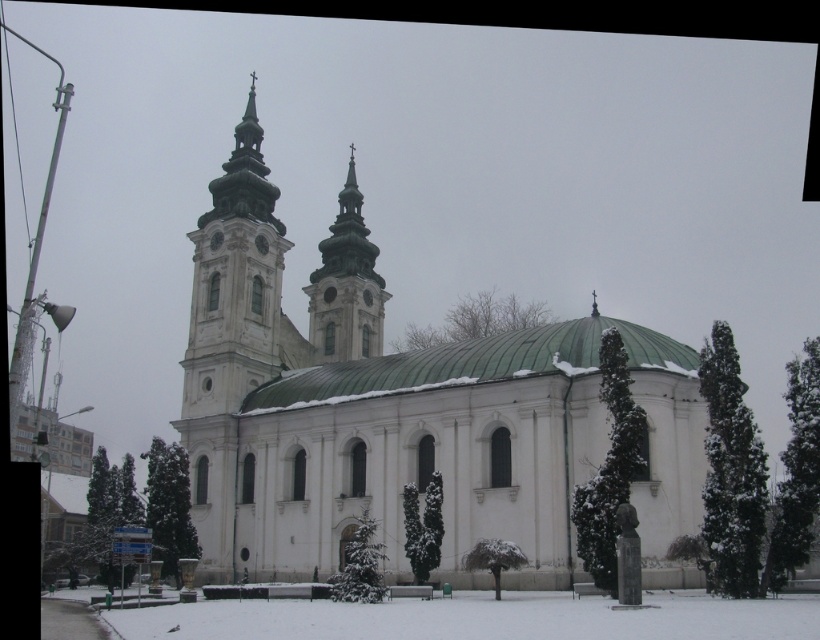
Between white stone tower at upper left and smooth white steeple at center, which one is positioned higher?

smooth white steeple at center

Where is `white stone tower at upper left`? Image resolution: width=820 pixels, height=640 pixels. white stone tower at upper left is located at coordinates (235, 282).

The width and height of the screenshot is (820, 640). Identify the location of white stone tower at upper left. (235, 282).

Between white stone church at center and white stone tower at upper left, which one is positioned lower?

Positioned lower is white stone church at center.

Measure the distance from white stone church at center to white stone tower at upper left.

white stone church at center and white stone tower at upper left are 20.83 feet apart.

Between point (306, 486) and point (240, 124), which one is positioned in front?

Point (306, 486) is more forward.

Find the location of a particular element. Image resolution: width=820 pixels, height=640 pixels. white stone church at center is located at coordinates (397, 408).

How much distance is there between white stone church at center and smooth white steeple at center?

The distance of white stone church at center from smooth white steeple at center is 11.74 meters.

Between white stone church at center and smooth white steeple at center, which one is positioned higher?

smooth white steeple at center

Is point (525, 490) more distant than point (310, 275)?

No, (525, 490) is closer to viewer.

Image resolution: width=820 pixels, height=640 pixels. Find the location of `white stone church at center`. white stone church at center is located at coordinates (397, 408).